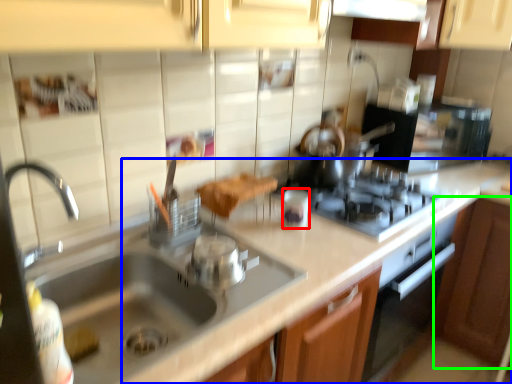
Question: Estimate the real-world distances between objects in this image. Which object is closer to appliance (highlighted by a red box), counter top (highlighted by a blue box) or cabinetry (highlighted by a green box)?

Choices:
 (A) counter top
 (B) cabinetry

Answer: (A)